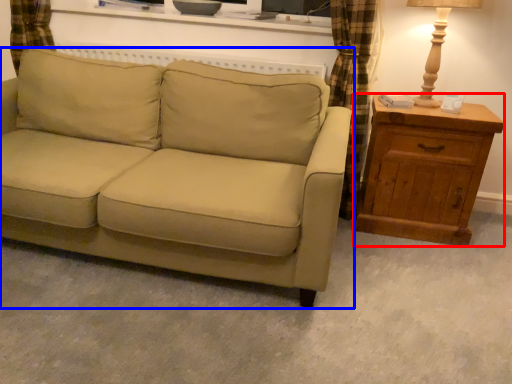
Question: Which point is further to the camera, chest of drawers (highlighted by a red box) or studio couch (highlighted by a blue box)?

Choices:
 (A) chest of drawers
 (B) studio couch

Answer: (A)